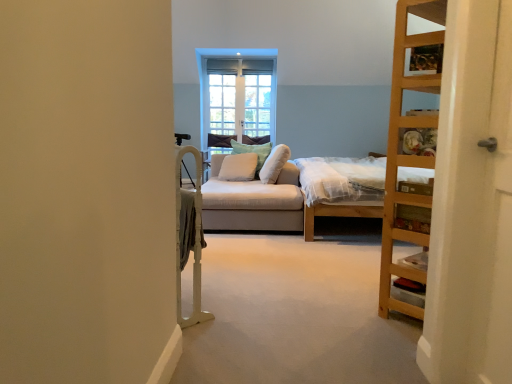
Question: Is the position of light brown wooden bed at right less distant than that of white soft pillow at center, which is the 3th pillow from left to right?

Choices:
 (A) yes
 (B) no

Answer: (A)

Question: Considering the relative sizes of light brown wooden bed at right and white soft pillow at center, which is the first pillow from right to left, in the image provided, is light brown wooden bed at right taller than white soft pillow at center, which is the first pillow from right to left,?

Choices:
 (A) yes
 (B) no

Answer: (A)

Question: From the image's perspective, does light brown wooden bed at right appear higher than white soft pillow at center, which is the first pillow from right to left?

Choices:
 (A) no
 (B) yes

Answer: (A)

Question: From the image's perspective, is light brown wooden bed at right below white soft pillow at center, which is the first pillow from right to left?

Choices:
 (A) no
 (B) yes

Answer: (B)

Question: Is light brown wooden bed at right at the right side of white soft pillow at center, which is the first pillow from right to left?

Choices:
 (A) no
 (B) yes

Answer: (B)

Question: Considering the relative sizes of light brown wooden bed at right and white soft pillow at center, which is the first pillow from right to left, in the image provided, is light brown wooden bed at right smaller than white soft pillow at center, which is the first pillow from right to left,?

Choices:
 (A) no
 (B) yes

Answer: (A)

Question: From a real-world perspective, is white wood screen door at right physically above white soft cushion at center, arranged as the third pillow when viewed from the right?

Choices:
 (A) yes
 (B) no

Answer: (A)

Question: Considering the relative sizes of white wood screen door at right and white soft cushion at center, arranged as the third pillow when viewed from the right, in the image provided, is white wood screen door at right bigger than white soft cushion at center, arranged as the third pillow when viewed from the right,?

Choices:
 (A) no
 (B) yes

Answer: (B)

Question: Is white wood screen door at right shorter than white soft cushion at center, marked as the 1th pillow in a left-to-right arrangement?

Choices:
 (A) yes
 (B) no

Answer: (B)

Question: Is white soft cushion at center, arranged as the third pillow when viewed from the right, completely or partially inside white wood screen door at right?

Choices:
 (A) yes
 (B) no

Answer: (B)

Question: Does white wood screen door at right have a smaller size compared to white soft cushion at center, marked as the 1th pillow in a left-to-right arrangement?

Choices:
 (A) yes
 (B) no

Answer: (B)

Question: Considering the relative positions of white wood screen door at right and white soft cushion at center, marked as the 1th pillow in a left-to-right arrangement, in the image provided, is white wood screen door at right to the left of white soft cushion at center, marked as the 1th pillow in a left-to-right arrangement, from the viewer's perspective?

Choices:
 (A) yes
 (B) no

Answer: (B)

Question: Does white wood screen door at right come in front of wooden ladder at right?

Choices:
 (A) yes
 (B) no

Answer: (A)